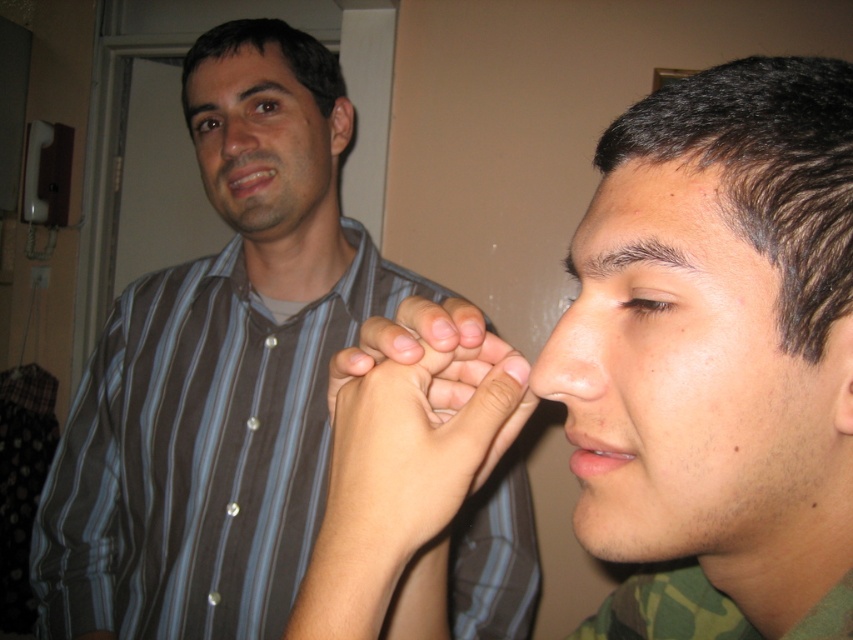
You are a photographer trying to focus on the matte striped shirt at center. What are the coordinates you should aim for?

The coordinates for the matte striped shirt at center are at point (723, 355).

You are a photographer trying to capture a closeup shot of the matte striped shirt at center and the smooth skin hand at center. Your camera has a minimum focus distance of 2.5 inches. Will you be able to focus on both subjects clearly?

The matte striped shirt at center and smooth skin hand at center are 2.58 inches apart from each other. Since the minimum focus distance is 2.5 inches, the camera can focus on both subjects clearly as the distance between them is slightly more than the required minimum focus distance.

You are a photographer trying to capture a closeup of the matte brown forehead at upper left and the matte skin nose at center. Which object should you zoom in on to get a wider shot of the feature?

The matte brown forehead at upper left has a larger width than the matte skin nose at center, so zooming in on the matte brown forehead at upper left will allow for a wider shot of the feature.